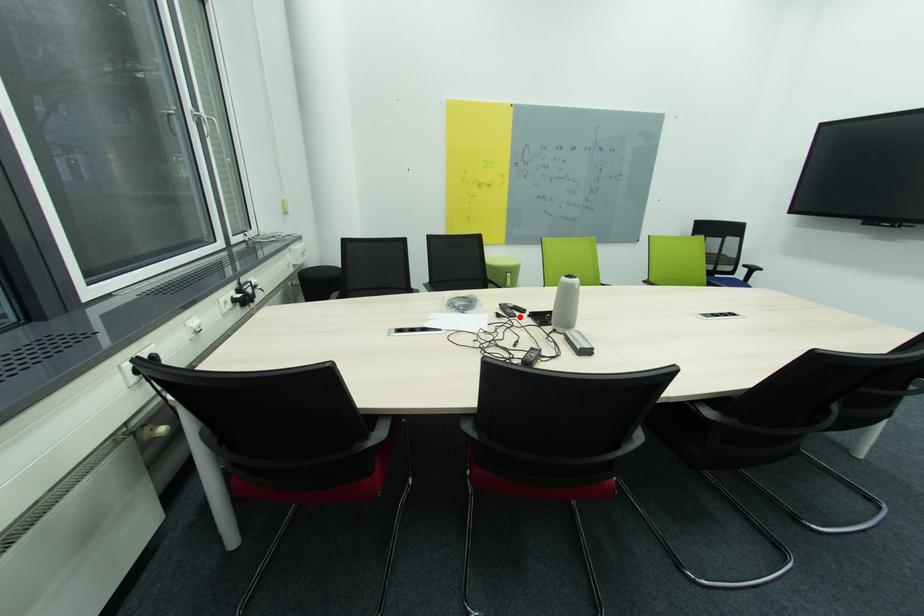
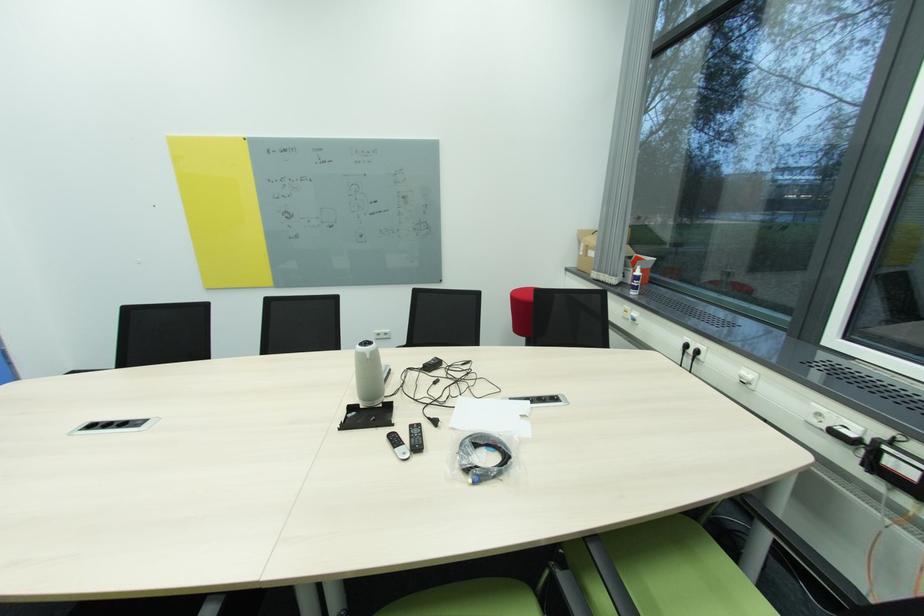
The point at the highlighted location is marked in the first image. Where is the corresponding point in the second image?

(416, 427)